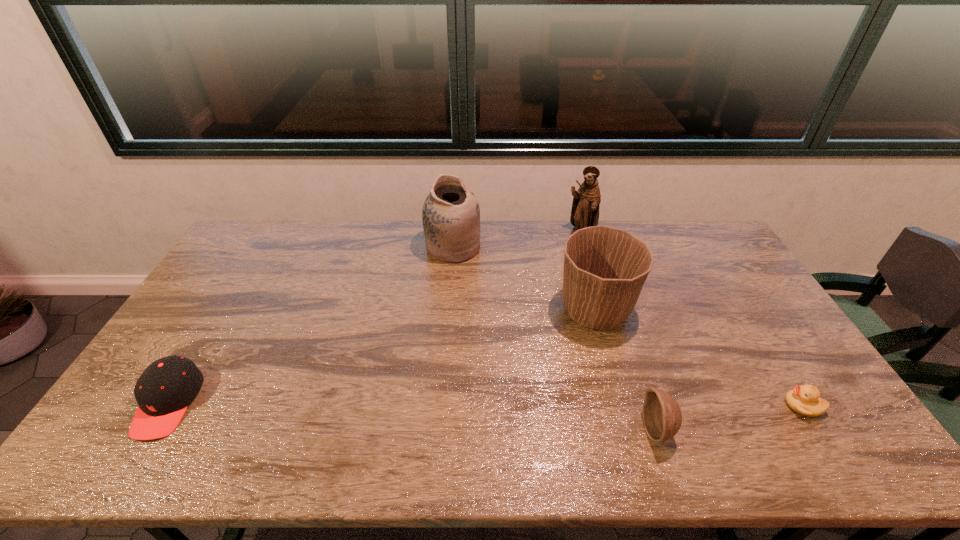
This screenshot has height=540, width=960. What are the coordinates of `vacant space situated on the right of the fourth nearest object` in the screenshot? It's located at (676, 310).

This screenshot has width=960, height=540. Identify the location of vacant space located 0.280m on the left of the third shortest object. (530, 429).

Where is `blank space located 0.300m on the beak of the rightmost object`? This screenshot has height=540, width=960. blank space located 0.300m on the beak of the rightmost object is located at coordinates (669, 406).

The height and width of the screenshot is (540, 960). Find the location of `vacant space located on the beak of the rightmost object`. vacant space located on the beak of the rightmost object is located at coordinates (704, 406).

The height and width of the screenshot is (540, 960). I want to click on free space located on the beak of the rightmost object, so click(x=758, y=406).

I want to click on figurine present at the far edge, so click(x=585, y=208).

At what (x,y) coordinates should I click in order to perform the action: click on pottery that is at the far edge. Please return your answer as a coordinate pair (x, y). Looking at the image, I should click on (451, 215).

Locate an element on the screen. bowl positioned at the near edge is located at coordinates (662, 417).

The height and width of the screenshot is (540, 960). In order to click on cap located at the near edge in this screenshot , I will do `click(164, 390)`.

Find the location of a particular element. Image resolution: width=960 pixels, height=540 pixels. object that is at the left edge is located at coordinates (164, 390).